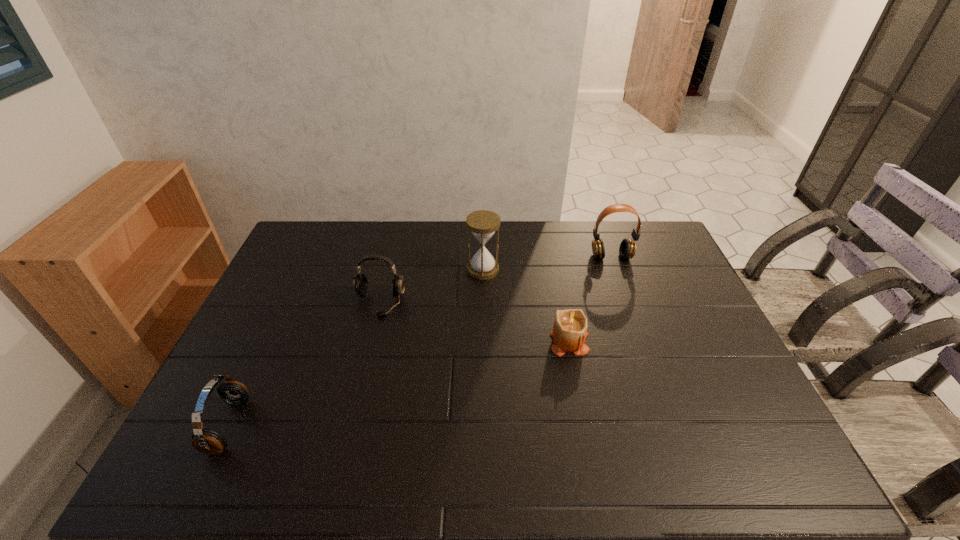
Locate an element on the screen. vacant space that satisfies the following two spatial constraints: 1. on the front side of the third object from right to left; 2. on the ear cups of the nearest headset is located at coordinates (484, 426).

At what (x,y) coordinates should I click in order to perform the action: click on free region that satisfies the following two spatial constraints: 1. with the microphone on the side of the second headset from left to right; 2. on the ear cups of the leftmost object. Please return your answer as a coordinate pair (x, y). The width and height of the screenshot is (960, 540). Looking at the image, I should click on (349, 426).

I want to click on blank area in the image that satisfies the following two spatial constraints: 1. with the microphone on the side of the third nearest object; 2. on the ear cups of the leftmost headset, so click(x=349, y=426).